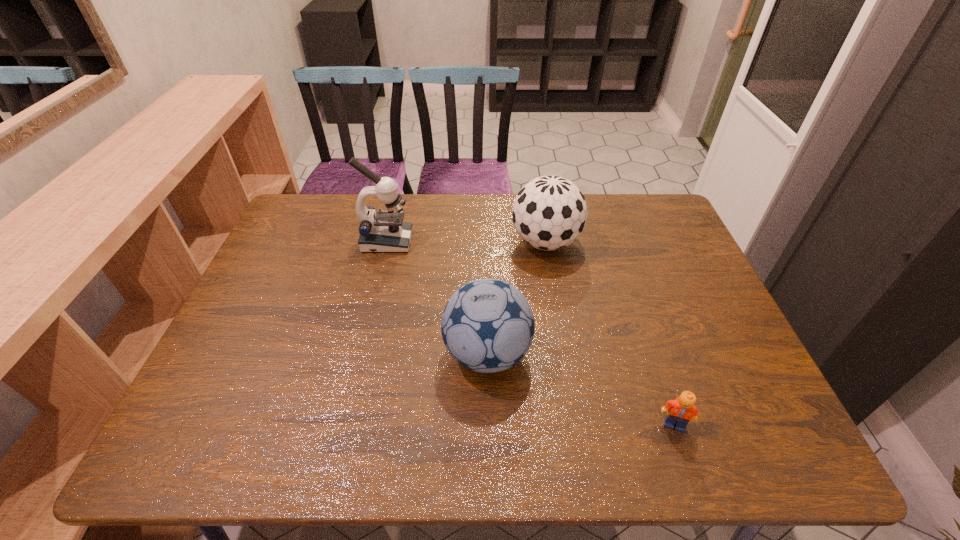
In the image, there is a desktop. Where is `vacant space at the far right corner`? This screenshot has height=540, width=960. vacant space at the far right corner is located at coordinates (638, 228).

You are a GUI agent. You are given a task and a screenshot of the screen. Output one action in this format:
    pyautogui.click(x=<x>, y=<y>)
    Task: Click on the empty space between the nearer soccer ball and the tallest object
    
    Given the screenshot: What is the action you would take?
    pyautogui.click(x=437, y=298)

Image resolution: width=960 pixels, height=540 pixels. Find the location of `vacant area between the farther soccer ball and the leftmost object`. vacant area between the farther soccer ball and the leftmost object is located at coordinates (467, 242).

Where is `blank region between the farther soccer ball and the microscope`? Image resolution: width=960 pixels, height=540 pixels. blank region between the farther soccer ball and the microscope is located at coordinates (467, 242).

At what (x,y) coordinates should I click in order to perform the action: click on vacant space that's between the tallest object and the farther soccer ball. Please return your answer as a coordinate pair (x, y). Looking at the image, I should click on (467, 242).

Find the location of a particular element. The width and height of the screenshot is (960, 540). unoccupied area between the tallest object and the farther soccer ball is located at coordinates (467, 242).

Select which object appears as the closest to the shortest object. Please provide its 2D coordinates. Your answer should be formatted as a tuple, i.e. [(x, y)], where the tuple contains the x and y coordinates of a point satisfying the conditions above.

[(487, 325)]

Where is `object that is the second closest to the farther soccer ball`? The height and width of the screenshot is (540, 960). object that is the second closest to the farther soccer ball is located at coordinates (384, 231).

What are the coordinates of `free space that satisfies the following two spatial constraints: 1. at the eyepiece of the farther soccer ball; 2. on the right side of the microscope` in the screenshot? It's located at (387, 242).

The width and height of the screenshot is (960, 540). What are the coordinates of `vacant area in the image that satisfies the following two spatial constraints: 1. on the back side of the farther soccer ball; 2. at the eyepiece of the leftmost object` in the screenshot? It's located at (545, 241).